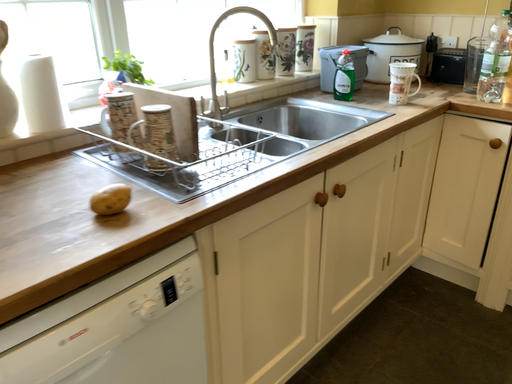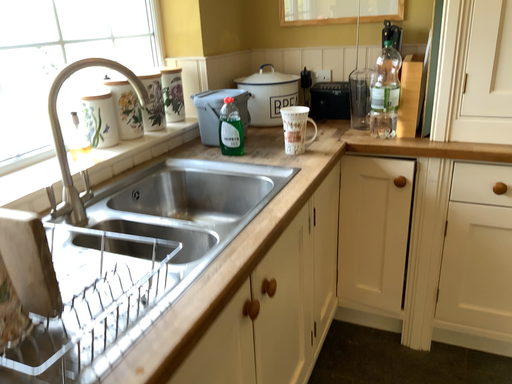
Question: Which way did the camera rotate in the video?

Choices:
 (A) rotated left
 (B) rotated right

Answer: (B)